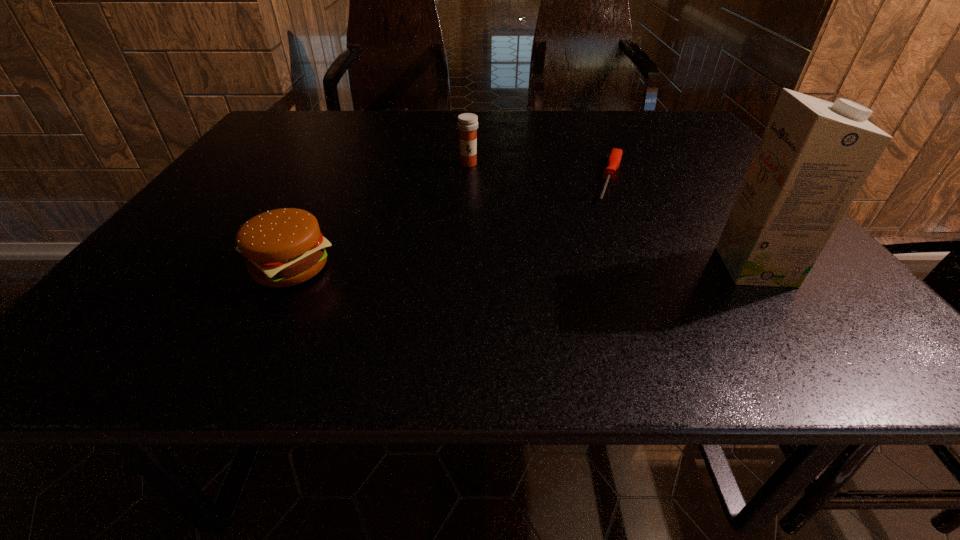
You are a GUI agent. You are given a task and a screenshot of the screen. Output one action in this format:
    pyautogui.click(x=<x>, y=<y>)
    Task: Click on the empty space that is in between the second tallest object and the tallest object
    The width and height of the screenshot is (960, 540).
    Given the screenshot: What is the action you would take?
    (x=612, y=215)

The image size is (960, 540). In order to click on unoccupied position between the third tallest object and the third object from left to right in this screenshot , I will do `click(450, 223)`.

The height and width of the screenshot is (540, 960). What are the coordinates of `free area in between the shortest object and the third object from right to left` in the screenshot? It's located at point(540,172).

You are a GUI agent. You are given a task and a screenshot of the screen. Output one action in this format:
    pyautogui.click(x=<x>, y=<y>)
    Task: Click on the blank region between the second object from left to right and the leftmost object
    This screenshot has width=960, height=540.
    Given the screenshot: What is the action you would take?
    pyautogui.click(x=379, y=215)

Find the location of `vacant space that is in between the shortest object and the medicine`. vacant space that is in between the shortest object and the medicine is located at coordinates pyautogui.click(x=540, y=172).

Locate which object ranks in proximity to the third tallest object. Please provide its 2D coordinates. Your answer should be formatted as a tuple, i.e. [(x, y)], where the tuple contains the x and y coordinates of a point satisfying the conditions above.

[(467, 124)]

Find the location of `object that is the third closest one to the third tallest object`. object that is the third closest one to the third tallest object is located at coordinates (814, 156).

Locate an element on the screen. This screenshot has height=540, width=960. free space that satisfies the following two spatial constraints: 1. on the front side of the tallest object; 2. on the left side of the screwdriver is located at coordinates (650, 267).

Identify the location of vacant region that satisfies the following two spatial constraints: 1. on the front side of the tallest object; 2. on the left side of the second tallest object. (464, 267).

Image resolution: width=960 pixels, height=540 pixels. I want to click on free space that satisfies the following two spatial constraints: 1. on the back side of the leftmost object; 2. on the left side of the medicine, so click(x=343, y=164).